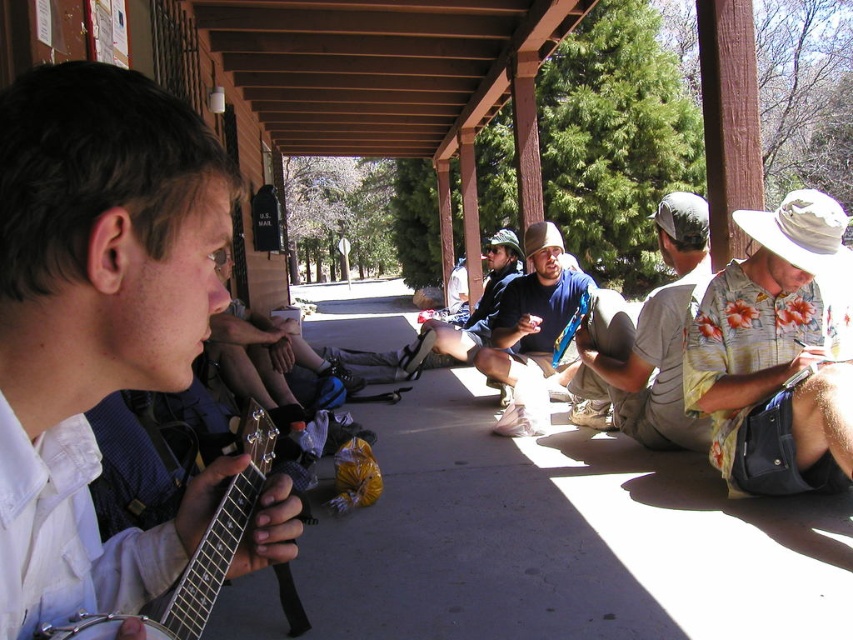
Question: Is matte black guitar at left to the right of metallic silver banjo at left from the viewer's perspective?

Choices:
 (A) no
 (B) yes

Answer: (A)

Question: Which object appears closest to the camera in this image?

Choices:
 (A) blue denim jeans at center
 (B) dark blue denim shorts at center

Answer: (A)

Question: Is floral cotton shirt at right behind dark blue denim shorts at center?

Choices:
 (A) yes
 (B) no

Answer: (B)

Question: Is matte black guitar at left in front of floral cotton shirt at right?

Choices:
 (A) no
 (B) yes

Answer: (B)

Question: Among these points, which one is farthest from the camera?

Choices:
 (A) (729, 392)
 (B) (521, 307)
 (C) (512, 243)

Answer: (C)

Question: Estimate the real-world distances between objects in this image. Which object is farther from the matte black guitar at left?

Choices:
 (A) metallic silver banjo at left
 (B) blue denim jeans at center
 (C) floral cotton shirt at right

Answer: (B)